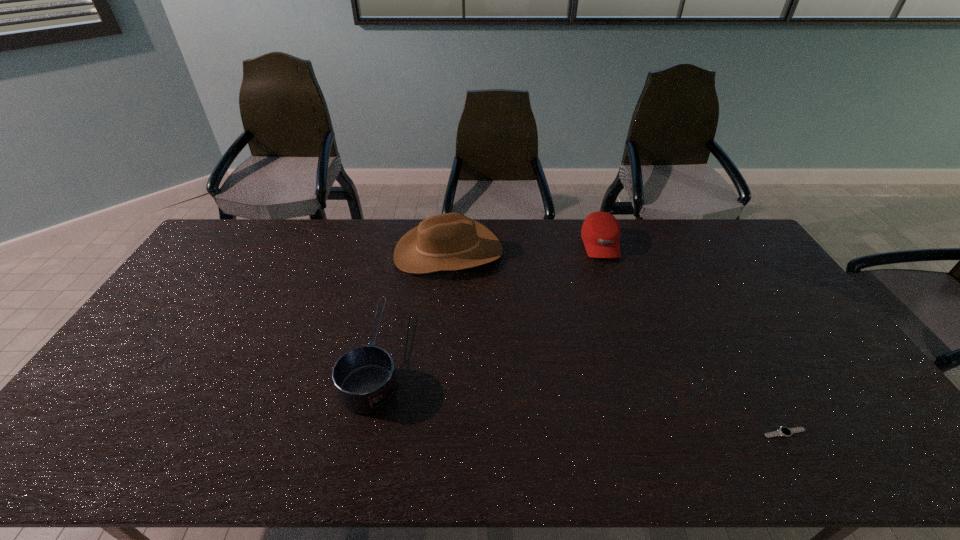
The width and height of the screenshot is (960, 540). I want to click on cowboy hat, so click(451, 241).

This screenshot has width=960, height=540. Find the location of `the second object from right to left`. the second object from right to left is located at coordinates (600, 232).

Where is `the second nearest object`? This screenshot has height=540, width=960. the second nearest object is located at coordinates (365, 379).

This screenshot has width=960, height=540. I want to click on watch, so click(x=784, y=431).

Locate an element on the screen. The height and width of the screenshot is (540, 960). the nearest object is located at coordinates (784, 431).

What are the coordinates of `vacant space located on the back of the tallest object` in the screenshot? It's located at (451, 219).

Image resolution: width=960 pixels, height=540 pixels. I want to click on vacant position located on the front-facing side of the third object from left to right, so click(x=613, y=282).

This screenshot has height=540, width=960. I want to click on vacant space located with the handle extending from one side of the saucepan, so click(x=398, y=257).

I want to click on free space located 0.300m with the handle extending from one side of the saucepan, so click(399, 253).

I want to click on free space located 0.200m with the handle extending from one side of the saucepan, so click(396, 271).